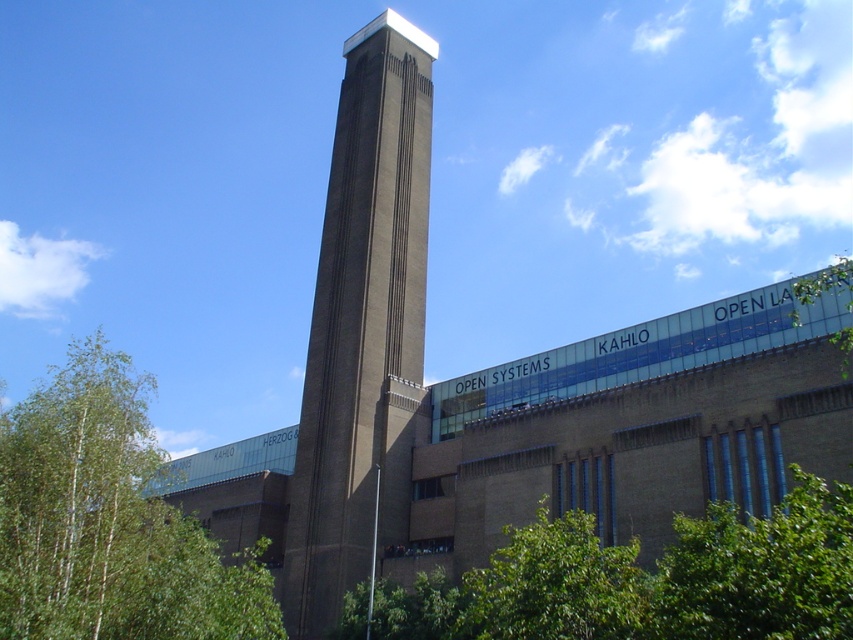
You are standing in front of the museum and want to determine the relative positions of two points marked on the building. Which point is closer to you, point 1 at coordinates (299, 604) or point 2 at coordinates (798, 324)?

Point 1 at coordinates (299, 604) is closer to you because it is further to the viewer than point 2 at coordinates (798, 324).